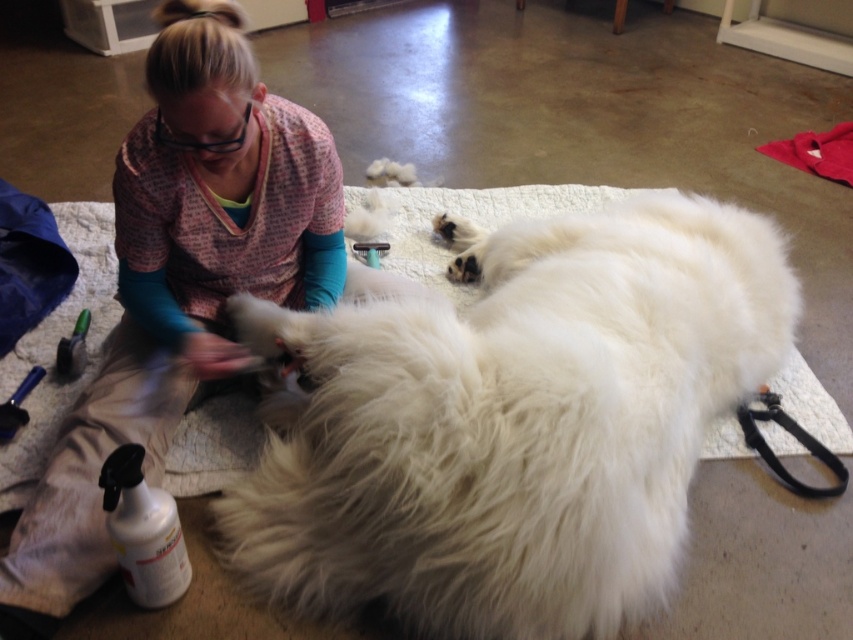
You are a pet groomer who needs to choose the right size of grooming table for the white fluffy dog at center and the black rubber leash at lower right. Based on their sizes, which one requires a larger space on the table?

The white fluffy dog at center requires a larger space on the table because its width is larger than the black rubber leash at lower right.